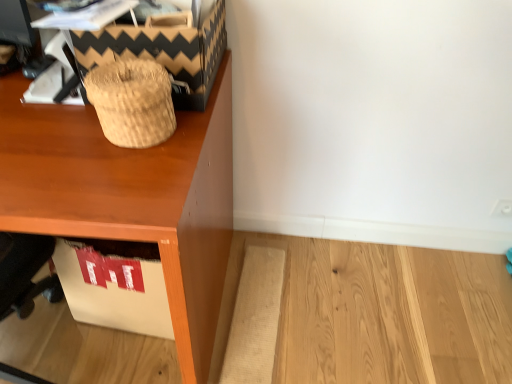
Question: From the image's perspective, would you say wooden desk at upper left is shown under woven straw basket at upper left?

Choices:
 (A) no
 (B) yes

Answer: (B)

Question: Would you say wooden desk at upper left contains woven straw basket at upper left?

Choices:
 (A) yes
 (B) no

Answer: (B)

Question: Considering the relative positions of wooden desk at upper left and woven straw basket at upper left in the image provided, is wooden desk at upper left to the right of woven straw basket at upper left from the viewer's perspective?

Choices:
 (A) no
 (B) yes

Answer: (A)

Question: From a real-world perspective, does wooden desk at upper left stand above woven straw basket at upper left?

Choices:
 (A) no
 (B) yes

Answer: (A)

Question: Does wooden desk at upper left have a lesser width compared to woven straw basket at upper left?

Choices:
 (A) no
 (B) yes

Answer: (A)

Question: From a real-world perspective, is brown woven basket at upper left above or below wooden desk at upper left?

Choices:
 (A) above
 (B) below

Answer: (A)

Question: Considering the positions of brown woven basket at upper left and wooden desk at upper left in the image, is brown woven basket at upper left wider or thinner than wooden desk at upper left?

Choices:
 (A) wide
 (B) thin

Answer: (B)

Question: Based on their sizes in the image, would you say brown woven basket at upper left is bigger or smaller than wooden desk at upper left?

Choices:
 (A) small
 (B) big

Answer: (A)

Question: From the image's perspective, relative to wooden desk at upper left, is brown woven basket at upper left above or below?

Choices:
 (A) above
 (B) below

Answer: (A)

Question: Is point (112, 79) closer or farther from the camera than point (186, 57)?

Choices:
 (A) farther
 (B) closer

Answer: (B)

Question: In terms of width, does woven straw basket at upper left look wider or thinner when compared to brown woven basket at upper left?

Choices:
 (A) thin
 (B) wide

Answer: (A)

Question: Visually, is woven straw basket at upper left positioned to the left or to the right of brown woven basket at upper left?

Choices:
 (A) left
 (B) right

Answer: (A)

Question: From the image's perspective, is woven straw basket at upper left positioned above or below brown woven basket at upper left?

Choices:
 (A) above
 (B) below

Answer: (B)

Question: Does point (172, 279) appear closer or farther from the camera than point (117, 132)?

Choices:
 (A) farther
 (B) closer

Answer: (B)

Question: Considering the positions of wooden desk at upper left and woven straw basket at upper left in the image, is wooden desk at upper left bigger or smaller than woven straw basket at upper left?

Choices:
 (A) small
 (B) big

Answer: (B)